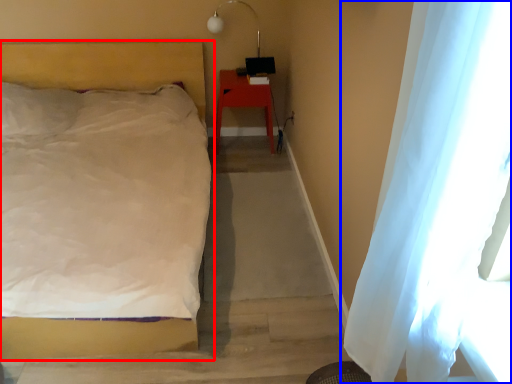
Question: Which object appears closest to the camera in this image, bed (highlighted by a red box) or curtain (highlighted by a blue box)?

Choices:
 (A) bed
 (B) curtain

Answer: (B)